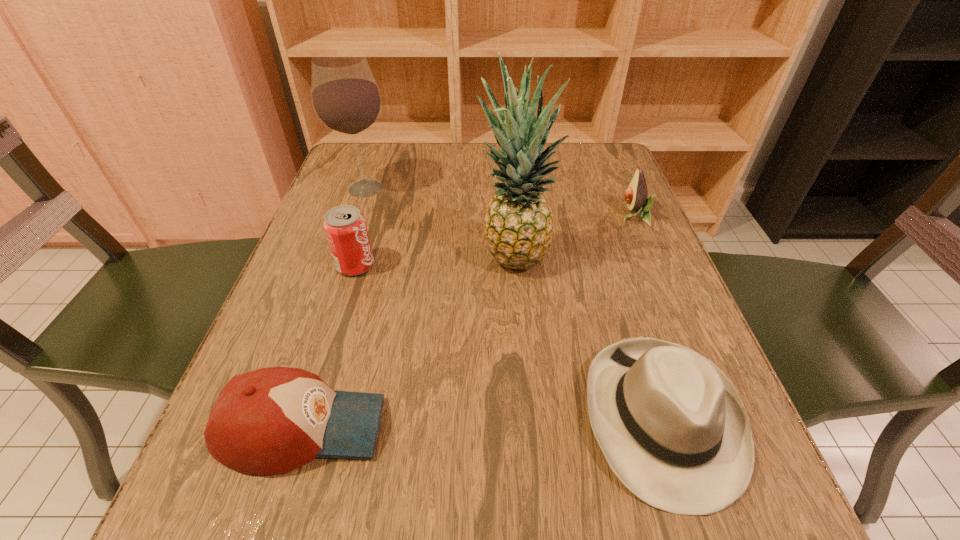
Where is `the tallest object`? the tallest object is located at coordinates (518, 226).

I want to click on the fourth object from left to right, so click(518, 226).

Where is `the fifth shortest object`? The height and width of the screenshot is (540, 960). the fifth shortest object is located at coordinates (346, 99).

Where is `soda can`? Image resolution: width=960 pixels, height=540 pixels. soda can is located at coordinates (345, 227).

Find the location of a particular element. avocado is located at coordinates (636, 195).

I want to click on baseball cap, so click(273, 420).

Find the location of a particular element. fedora is located at coordinates (671, 425).

This screenshot has width=960, height=540. Identify the location of free space located on the back of the tallest object. (511, 218).

Find the location of a particular element. This screenshot has height=540, width=960. vacant space located 0.340m on the right of the alcohol is located at coordinates (533, 188).

I want to click on vacant space located 0.100m on the right of the soda can, so click(424, 265).